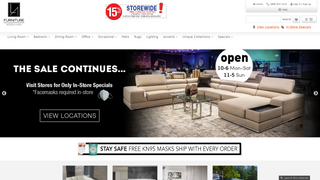
The image size is (320, 180). I want to click on decorative object, so click(192, 91), click(189, 92).